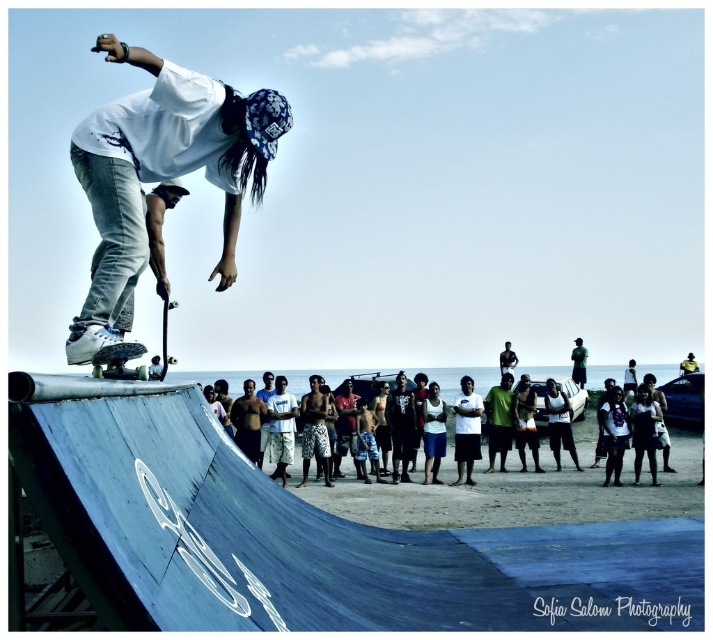
Is skinny man at center wider than smooth black skateboard at center?

Incorrect, skinny man at center's width does not surpass smooth black skateboard at center's.

Is point (252, 448) positioned behind point (160, 328)?

No, (252, 448) is in front of (160, 328).

This screenshot has height=640, width=713. I want to click on skinny man at center, so click(247, 420).

Is white cotton shirt at center smaller than smooth black skateboard at center?

Yes.

Which is in front, point (277, 397) or point (153, 371)?

Point (153, 371) is in front.

Find the location of a particular element. white cotton shirt at center is located at coordinates (282, 428).

Which is behind, point (240, 513) or point (230, 228)?

The point (230, 228) is behind.

Can you confirm if blue painted wood ramp at lower left is taller than white matte skateboard at center?

In fact, blue painted wood ramp at lower left may be shorter than white matte skateboard at center.

Between point (145, 561) and point (235, 280), which one is positioned in front?

Point (145, 561) is more forward.

At what (x,y) coordinates should I click in order to perform the action: click on blue painted wood ramp at lower left. Please return your answer as a coordinate pair (x, y). Looking at the image, I should click on (302, 536).